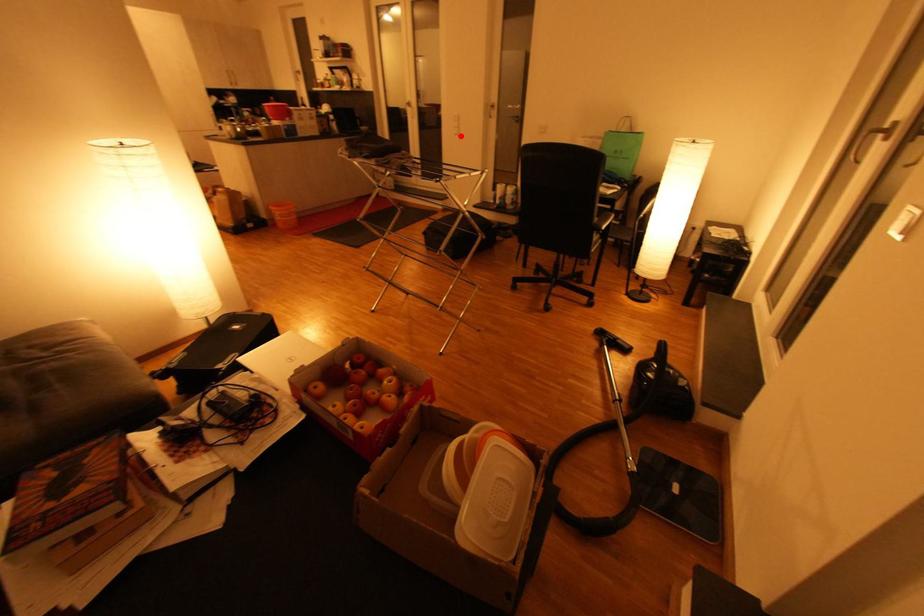
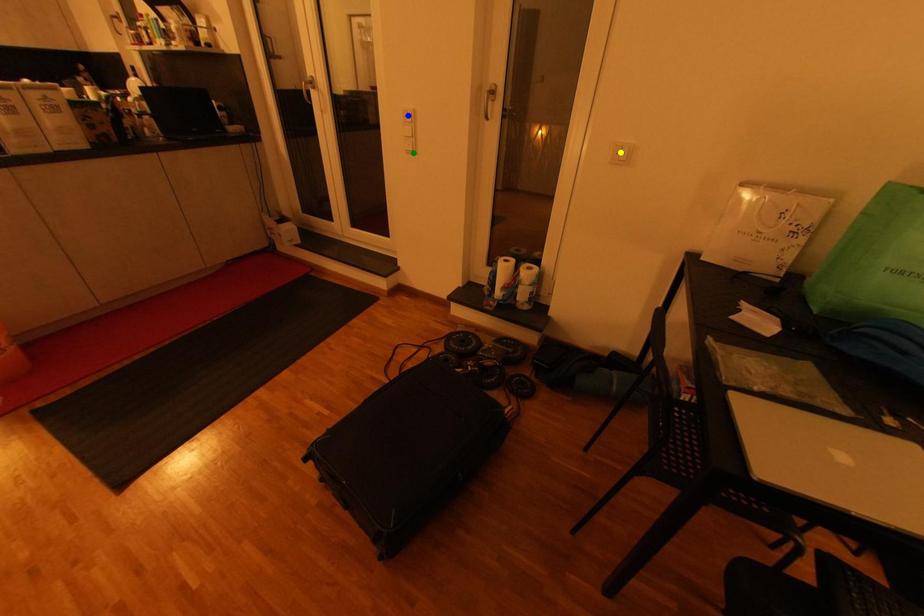
Question: I am providing you with two images of the same scene from different viewpoints. A red point is marked on the first image. You are given multiple points on the second image. Which mark in image 2 goes with the point in image 1?

Choices:
 (A) yellow point
 (B) green point
 (C) blue point

Answer: (B)